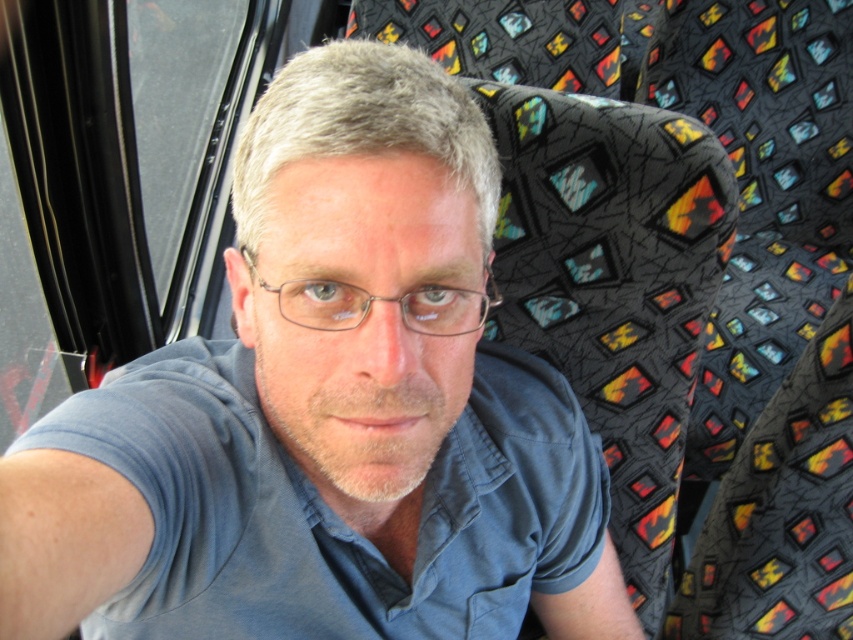
You are a photographer taking a picture of the person in the vehicle. You notice the blue cotton shirt at center and the clear plastic glasses at center. Which object is closer to the camera?

The blue cotton shirt at center is located below the clear plastic glasses at center, so the clear plastic glasses at center is closer to the camera.